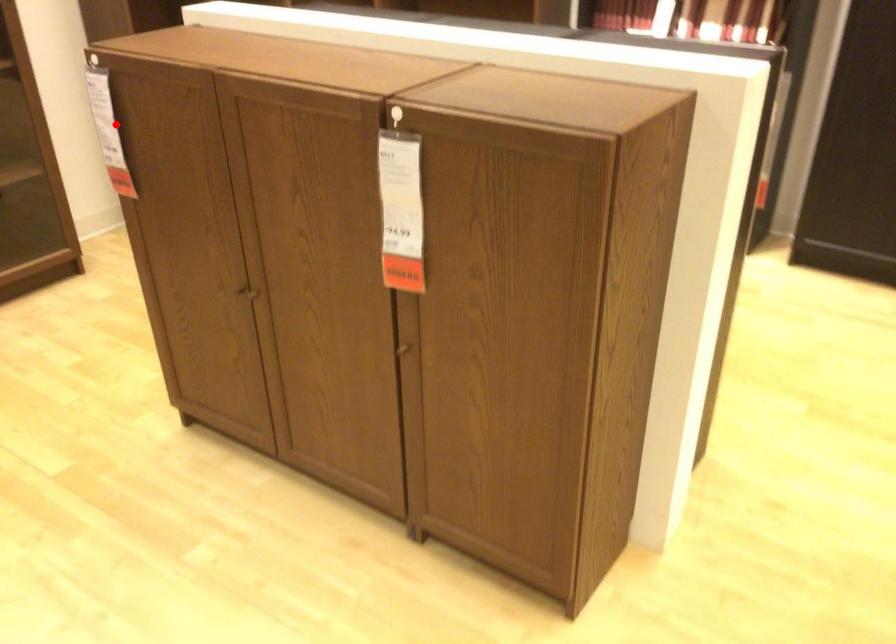
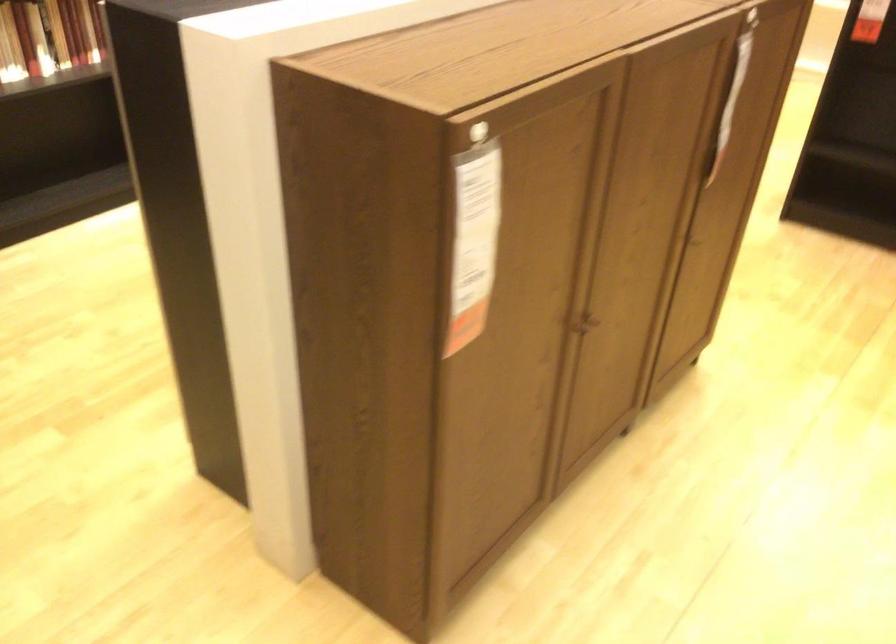
In the second image, find the point that corresponds to the highlighted location in the first image.

(474, 242)